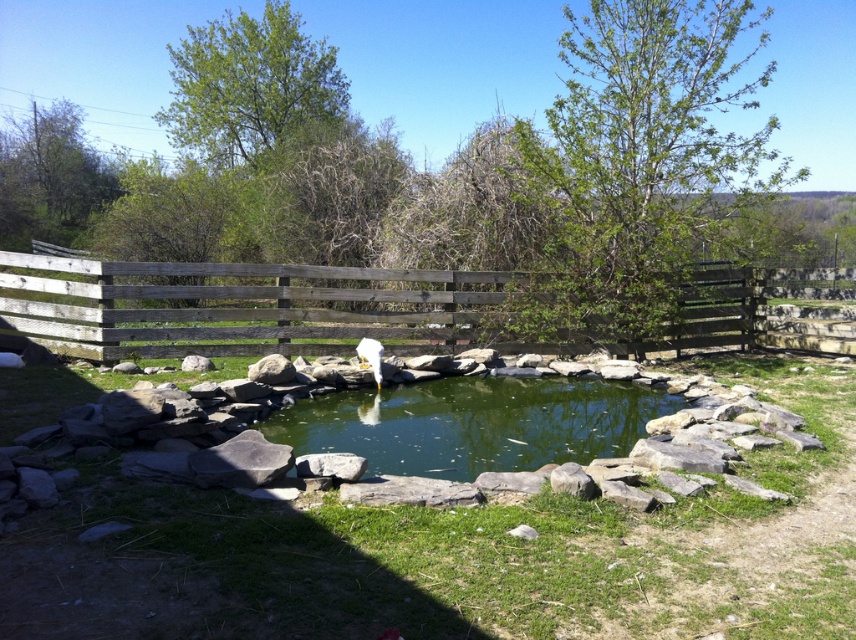
Measure the distance between wooden fence at center and green liquid water at center.

The distance of wooden fence at center from green liquid water at center is 8.95 feet.

Based on the photo, which is below, wooden fence at center or green liquid water at center?

Result: green liquid water at center is lower down.

In order to click on wooden fence at center in this screenshot , I will do `click(342, 310)`.

Identify the location of wooden fence at center. The image size is (856, 640). (342, 310).

Is point (185, 316) farther from camera compared to point (361, 342)?

That is True.

The image size is (856, 640). Describe the element at coordinates (342, 310) in the screenshot. I see `wooden fence at center` at that location.

Which is behind, point (90, 349) or point (358, 355)?

The point (358, 355) is more distant.

This screenshot has width=856, height=640. What are the coordinates of `wooden fence at center` in the screenshot? It's located at (342, 310).

Describe the element at coordinates (473, 422) in the screenshot. The width and height of the screenshot is (856, 640). I see `green liquid water at center` at that location.

Which is more to the right, green liquid water at center or white fluffy bird at center?

green liquid water at center is more to the right.

Is point (283, 413) behind point (369, 342)?

No, it is not.

This screenshot has height=640, width=856. I want to click on green liquid water at center, so click(x=473, y=422).